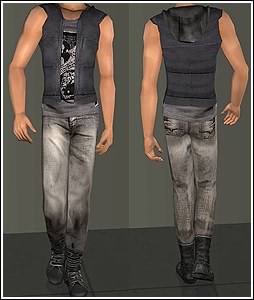
Image resolution: width=254 pixels, height=300 pixels. Identify the location of line in floor. (134, 287).